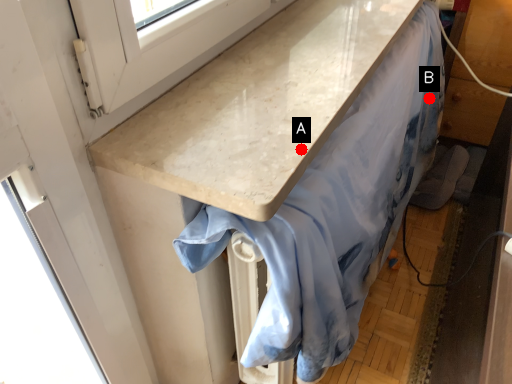
Question: Two points are circled on the image, labeled by A and B beside each circle. Which point appears farthest from the camera in this image?

Choices:
 (A) A is further
 (B) B is further

Answer: (B)